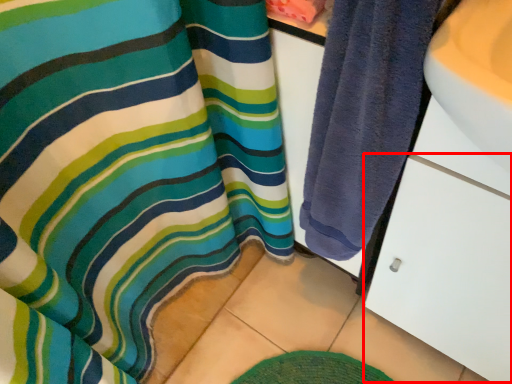
Question: From the image's perspective, what is the correct spatial positioning of drawer (annotated by the red box) in reference to towel?

Choices:
 (A) above
 (B) below

Answer: (B)